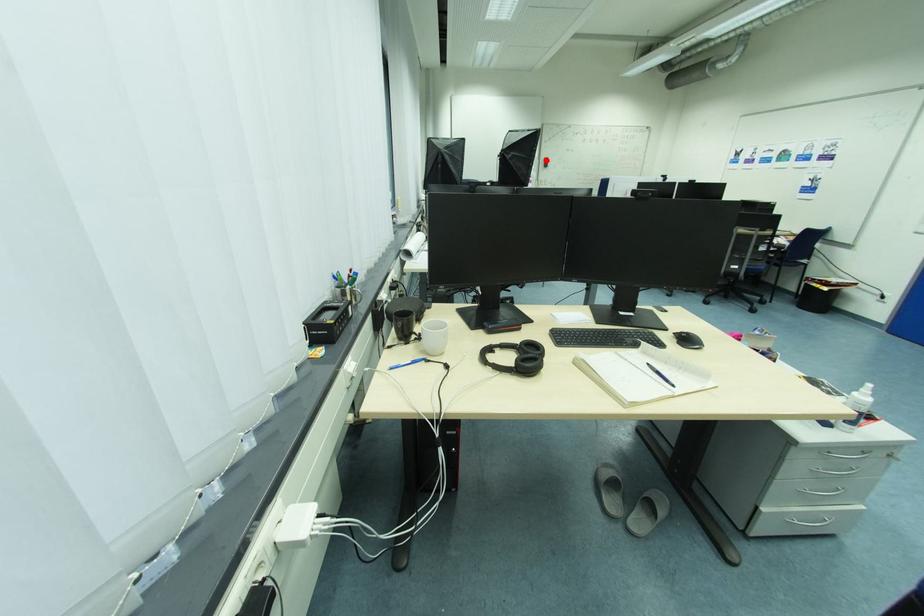
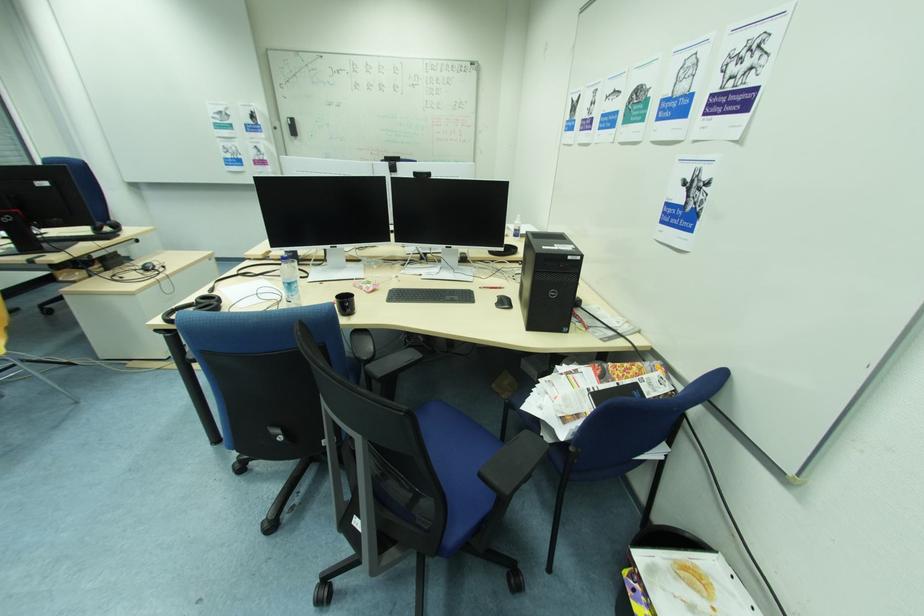
Question: I am providing you with two images of the same scene from different viewpoints. A red point is shown in image1. For the corresponding object point in image2, is it positioned nearer or farther from the camera?

Choices:
 (A) Nearer
 (B) Farther

Answer: (B)